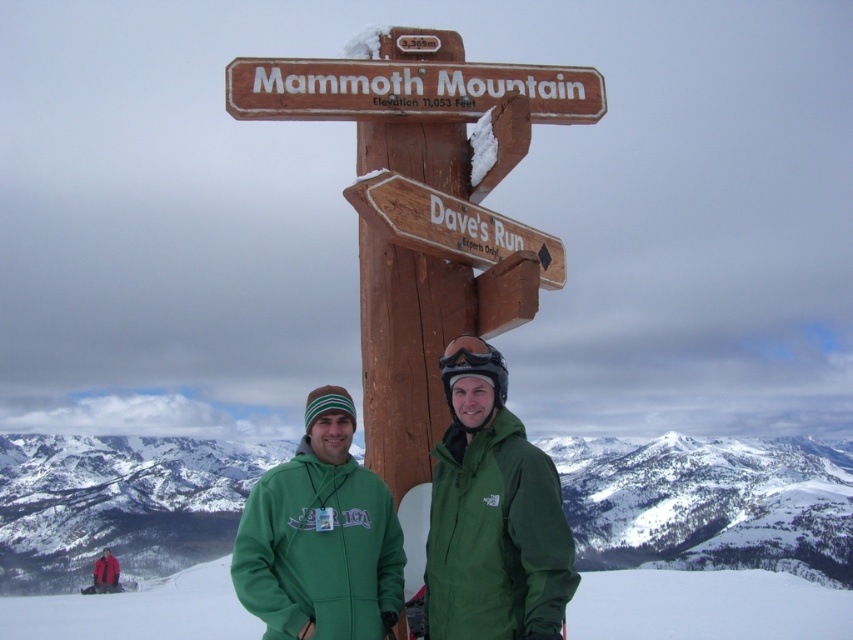
Question: Observing the image, what is the correct spatial positioning of green fabric ski slope at lower center in reference to green fleece jacket at center?

Choices:
 (A) above
 (B) below

Answer: (B)

Question: Which of the following is the closest to the observer?

Choices:
 (A) (93, 627)
 (B) (252, 516)
 (C) (489, 490)

Answer: (C)

Question: Can you confirm if green matte jacket at center is bigger than wooden signpost at lower center?

Choices:
 (A) yes
 (B) no

Answer: (B)

Question: Which point is farther from the camera taking this photo?

Choices:
 (A) (486, 364)
 (B) (373, 502)
 (C) (598, 108)

Answer: (C)

Question: Among these objects, which one is nearest to the camera?

Choices:
 (A) green matte jacket at center
 (B) green fabric ski slope at lower center

Answer: (A)

Question: Is green matte jacket at center above green fleece jacket at center?

Choices:
 (A) no
 (B) yes

Answer: (B)